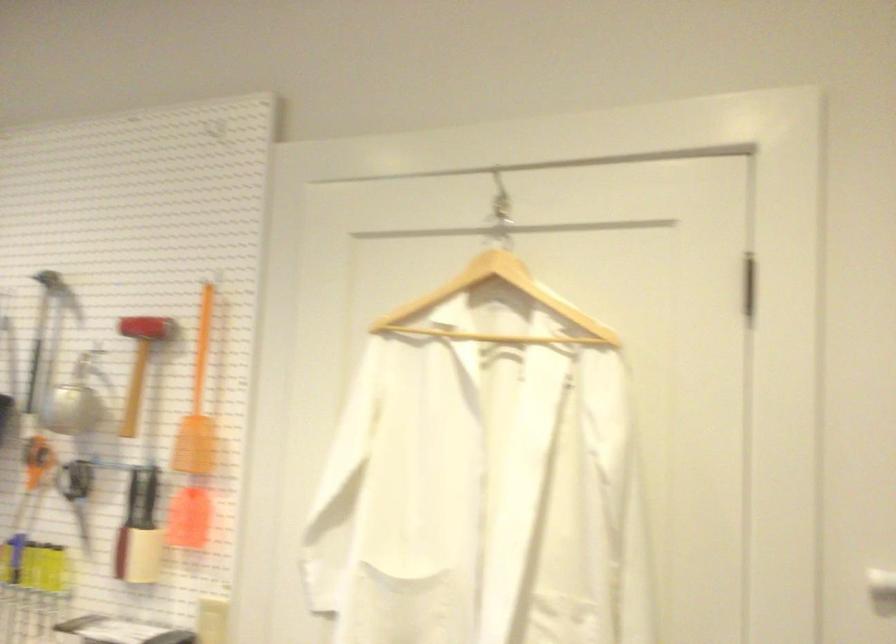
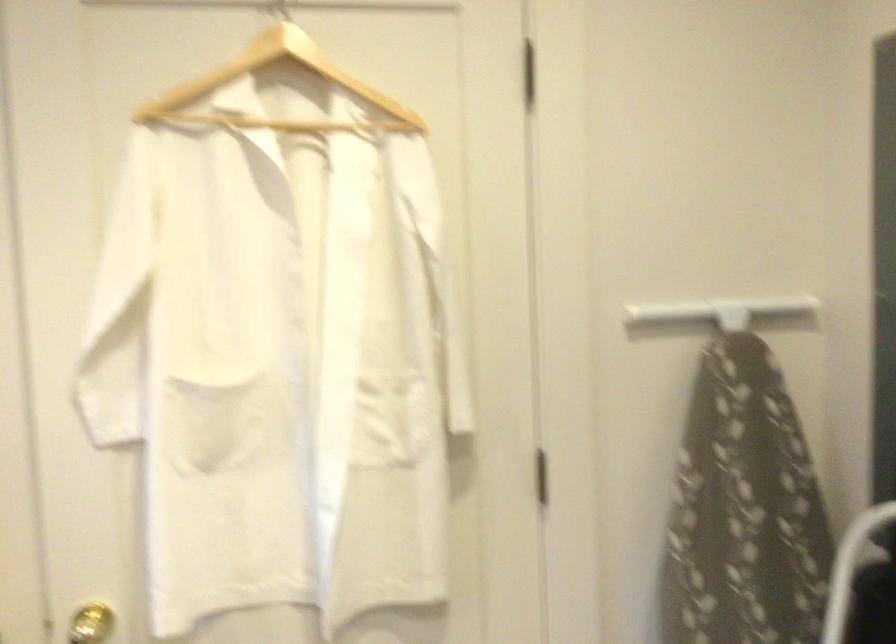
Question: How did the camera likely rotate?

Choices:
 (A) Left
 (B) Right
 (C) Up
 (D) Down

Answer: (B)